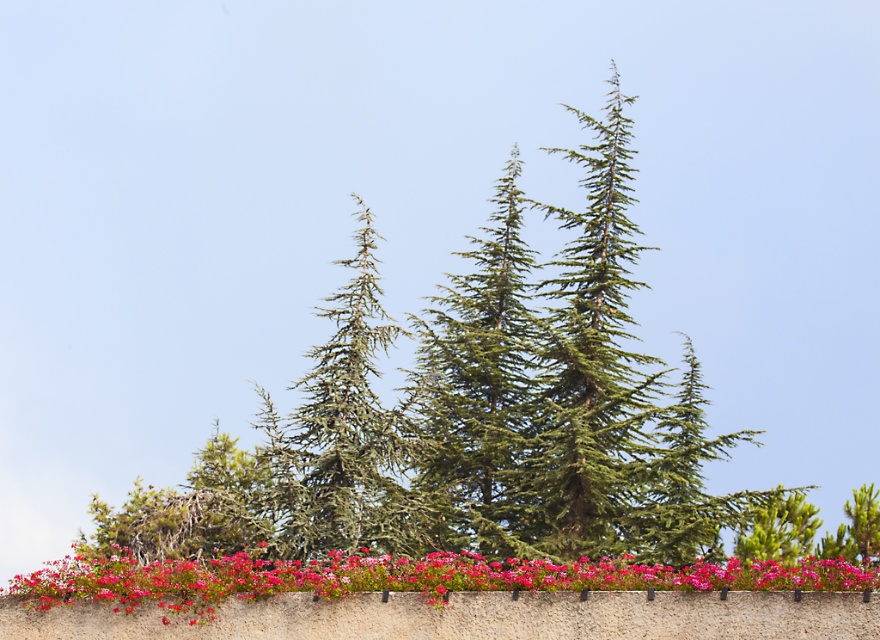
Question: Is smooth pink petals at lower center thinner than green needle-like at center?

Choices:
 (A) yes
 (B) no

Answer: (B)

Question: Observing the image, what is the correct spatial positioning of smooth pink petals at lower center in reference to green needle-like at center?

Choices:
 (A) left
 (B) right

Answer: (B)

Question: Which point is farther to the camera?

Choices:
 (A) (327, 460)
 (B) (772, 580)

Answer: (A)

Question: Is smooth pink petals at lower center thinner than green needle-like at center?

Choices:
 (A) no
 (B) yes

Answer: (A)

Question: Which point is farther to the camera?

Choices:
 (A) smooth pink petals at lower center
 (B) green needle-like at center

Answer: (B)